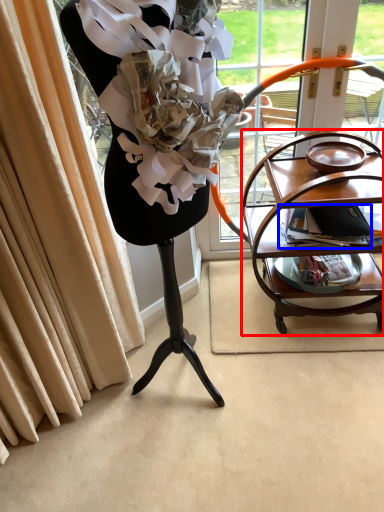
Question: Which of the following is the farthest to the observer, table (highlighted by a red box) or magazine (highlighted by a blue box)?

Choices:
 (A) table
 (B) magazine

Answer: (B)